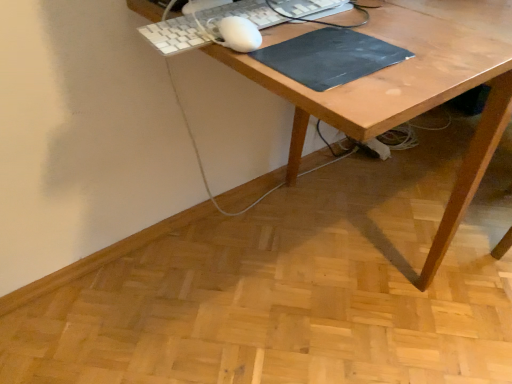
Where is `black matte mousepad at center`? This screenshot has width=512, height=384. black matte mousepad at center is located at coordinates (330, 57).

What do you see at coordinates (412, 89) in the screenshot? I see `wooden desk at center` at bounding box center [412, 89].

Locate an element on the screen. Image resolution: width=512 pixels, height=384 pixels. white plastic keyboard at upper center is located at coordinates (175, 35).

What are the coordinates of `black matte mousepad at center` in the screenshot? It's located at (x=330, y=57).

Find the location of `computer keyboard that is above the black matte mousepad at center (from the image's perspective)`. computer keyboard that is above the black matte mousepad at center (from the image's perspective) is located at coordinates (175, 35).

Is white plastic keyboard at upper center surrounded by black matte mousepad at center?

No, white plastic keyboard at upper center is not a part of black matte mousepad at center.

Based on the photo, can you confirm if black matte mousepad at center is thinner than white plastic keyboard at upper center?

No.

Looking at this image, from the image's perspective, is black matte mousepad at center located above or below white plastic keyboard at upper center?

Based on their image positions, black matte mousepad at center is located beneath white plastic keyboard at upper center.

Between black matte mousepad at center and wooden desk at center, which one has more height?

Standing taller between the two is wooden desk at center.

Find the location of a particular element. The width and height of the screenshot is (512, 384). mousepad below the wooden desk at center (from the image's perspective) is located at coordinates (330, 57).

Is point (335, 42) farther from camera compared to point (225, 48)?

Yes, point (335, 42) is behind point (225, 48).

Is black matte mousepad at center located outside wooden desk at center?

No, black matte mousepad at center is not outside of wooden desk at center.

Is white plastic keyboard at upper center further to camera compared to black matte mousepad at center?

Yes, it is behind black matte mousepad at center.

Between white plastic keyboard at upper center and black matte mousepad at center, which one has larger width?

With larger width is black matte mousepad at center.

How many degrees apart are the facing directions of white plastic keyboard at upper center and black matte mousepad at center?

The facing directions of white plastic keyboard at upper center and black matte mousepad at center are 0.945 degrees apart.

From the image's perspective, is white plastic keyboard at upper center on top of black matte mousepad at center?

Yes, from the image's perspective, white plastic keyboard at upper center is above black matte mousepad at center.

From a real-world perspective, is white plastic keyboard at upper center physically located above or below wooden desk at center?

Clearly, from a real-world perspective, white plastic keyboard at upper center is above wooden desk at center.

Between white plastic keyboard at upper center and wooden desk at center, which one has larger width?

Wider between the two is wooden desk at center.

Is white plastic keyboard at upper center oriented towards wooden desk at center?

No, white plastic keyboard at upper center is not facing towards wooden desk at center.

How much distance is there between white plastic keyboard at upper center and wooden desk at center?

A distance of 7.86 inches exists between white plastic keyboard at upper center and wooden desk at center.

Can you see wooden desk at center touching white plastic keyboard at upper center?

No, wooden desk at center is not making contact with white plastic keyboard at upper center.

Does point (384, 6) appear closer or farther from the camera than point (336, 5)?

Point (384, 6) appears to be farther away from the viewer than point (336, 5).

Would you say wooden desk at center is inside or outside white plastic keyboard at upper center?

wooden desk at center is not inside white plastic keyboard at upper center, it's outside.

Does wooden desk at center have a lesser height compared to white plastic keyboard at upper center?

In fact, wooden desk at center may be taller than white plastic keyboard at upper center.

From the image's perspective, between wooden desk at center and black matte mousepad at center, who is located below?

black matte mousepad at center appears lower in the image.

Which object is positioned more to the right, wooden desk at center or black matte mousepad at center?

From the viewer's perspective, wooden desk at center appears more on the right side.

In terms of width, does wooden desk at center look wider or thinner when compared to black matte mousepad at center?

wooden desk at center is wider than black matte mousepad at center.

Is wooden desk at center in contact with black matte mousepad at center?

wooden desk at center and black matte mousepad at center are not in contact.

What are the coordinates of `mousepad in front of the white plastic keyboard at upper center` in the screenshot? It's located at (330, 57).

The height and width of the screenshot is (384, 512). I want to click on mousepad that appears behind the wooden desk at center, so click(x=330, y=57).

Looking at the image, which one is located closer to white plastic keyboard at upper center, black matte mousepad at center or wooden desk at center?

black matte mousepad at center is closer to white plastic keyboard at upper center.

Estimate the real-world distances between objects in this image. Which object is closer to wooden desk at center, white plastic keyboard at upper center or black matte mousepad at center?

The object closer to wooden desk at center is black matte mousepad at center.

Estimate the real-world distances between objects in this image. Which object is further from wooden desk at center, black matte mousepad at center or white plastic keyboard at upper center?

Based on the image, white plastic keyboard at upper center appears to be further to wooden desk at center.

Looking at the image, which one is located closer to white plastic keyboard at upper center, wooden desk at center or black matte mousepad at center?

Based on the image, black matte mousepad at center appears to be nearer to white plastic keyboard at upper center.

Based on their spatial positions, is wooden desk at center or white plastic keyboard at upper center closer to black matte mousepad at center?

wooden desk at center lies closer to black matte mousepad at center than the other object.

From the image, which object appears to be nearer to black matte mousepad at center, white plastic keyboard at upper center or wooden desk at center?

wooden desk at center lies closer to black matte mousepad at center than the other object.

Image resolution: width=512 pixels, height=384 pixels. What are the coordinates of `mousepad between white plastic keyboard at upper center and wooden desk at center from left to right` in the screenshot? It's located at (330, 57).